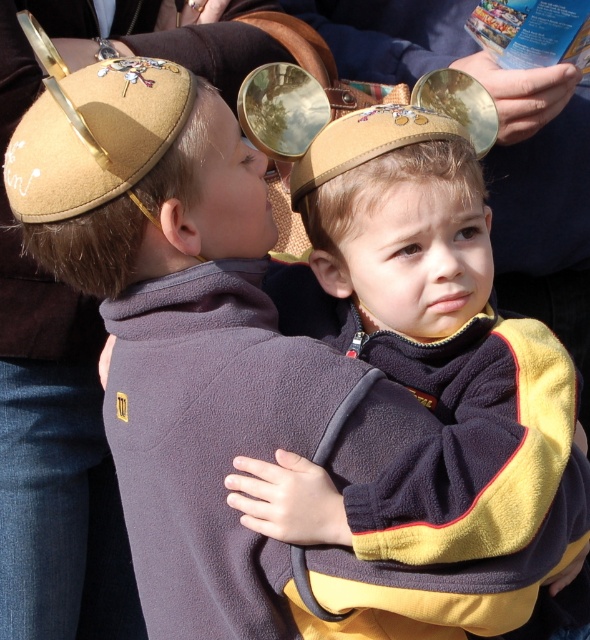
Question: Which object appears closest to the camera in this image?

Choices:
 (A) suede kippah at upper left
 (B) matte brown hat at center

Answer: (A)

Question: Among these points, which one is nearest to the camera?

Choices:
 (A) (489, 509)
 (B) (467, 172)
 (C) (99, 205)

Answer: (A)

Question: Can you confirm if matte brown sweater at center is positioned below suede kippah at upper left?

Choices:
 (A) yes
 (B) no

Answer: (A)

Question: Among these objects, which one is nearest to the camera?

Choices:
 (A) suede kippah at upper left
 (B) matte brown hat at center
 (C) matte brown sweater at center

Answer: (C)

Question: Is matte brown sweater at center bigger than suede kippah at upper left?

Choices:
 (A) yes
 (B) no

Answer: (A)

Question: Is matte brown hat at center above suede kippah at upper left?

Choices:
 (A) yes
 (B) no

Answer: (B)